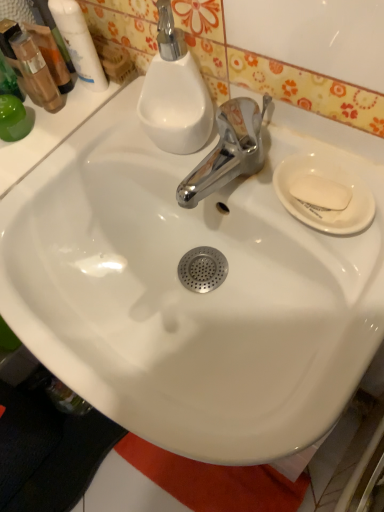
Image resolution: width=384 pixels, height=512 pixels. What do you see at coordinates (79, 42) in the screenshot?
I see `white glossy mouthwash at upper left, which is counted as the first mouthwash, starting from the right` at bounding box center [79, 42].

What is the approximate width of white glossy mouthwash at upper left, acting as the second mouthwash starting from the left?

1.27 inches.

This screenshot has width=384, height=512. What are the coordinates of `translucent plastic mouthwash at upper left, which is the second mouthwash in right-to-left order` in the screenshot? It's located at (32, 69).

Identify the location of white ceramic plate at right. (323, 195).

Is translucent plastic mouthwash at upper left, the 1th mouthwash in the left-to-right sequence, wider or thinner than white ceramic plate at right?

translucent plastic mouthwash at upper left, the 1th mouthwash in the left-to-right sequence, is thinner than white ceramic plate at right.

Is translucent plastic mouthwash at upper left, which is the second mouthwash in right-to-left order, to the left or to the right of white ceramic plate at right in the image?

Clearly, translucent plastic mouthwash at upper left, which is the second mouthwash in right-to-left order, is on the left of white ceramic plate at right in the image.

Is translucent plastic mouthwash at upper left, which is the second mouthwash in right-to-left order, taller or shorter than white ceramic plate at right?

Considering their sizes, translucent plastic mouthwash at upper left, which is the second mouthwash in right-to-left order, has more height than white ceramic plate at right.

From the picture: Is translucent plastic mouthwash at upper left, which is the second mouthwash in right-to-left order, surrounding white ceramic plate at right?

No, translucent plastic mouthwash at upper left, which is the second mouthwash in right-to-left order, does not contain white ceramic plate at right.

Can you confirm if white glossy mouthwash at upper left, acting as the second mouthwash starting from the left, is shorter than translucent plastic mouthwash at upper left, the 1th mouthwash in the left-to-right sequence?

No, white glossy mouthwash at upper left, acting as the second mouthwash starting from the left, is not shorter than translucent plastic mouthwash at upper left, the 1th mouthwash in the left-to-right sequence.

Is there a large distance between white glossy mouthwash at upper left, which is counted as the first mouthwash, starting from the right, and translucent plastic mouthwash at upper left, which is the second mouthwash in right-to-left order?

No, white glossy mouthwash at upper left, which is counted as the first mouthwash, starting from the right, is not far from translucent plastic mouthwash at upper left, which is the second mouthwash in right-to-left order.

Which is behind, white glossy mouthwash at upper left, acting as the second mouthwash starting from the left, or translucent plastic mouthwash at upper left, which is the second mouthwash in right-to-left order?

translucent plastic mouthwash at upper left, which is the second mouthwash in right-to-left order.

Consider the image. From the image's perspective, is white glossy mouthwash at upper left, acting as the second mouthwash starting from the left, on top of translucent plastic mouthwash at upper left, which is the second mouthwash in right-to-left order?

Yes, from the image's perspective, white glossy mouthwash at upper left, acting as the second mouthwash starting from the left, is over translucent plastic mouthwash at upper left, which is the second mouthwash in right-to-left order.

Can you confirm if white glossy mouthwash at upper left, acting as the second mouthwash starting from the left, is positioned to the left of white matte soap at right?

Indeed, white glossy mouthwash at upper left, acting as the second mouthwash starting from the left, is positioned on the left side of white matte soap at right.

Is point (72, 62) positioned behind point (329, 188)?

Yes.

The image size is (384, 512). Identify the location of soap lying below the white glossy mouthwash at upper left, acting as the second mouthwash starting from the left (from the image's perspective). (321, 192).

Can white glossy mouthwash at upper left, acting as the second mouthwash starting from the left, be found inside white matte soap at right?

No, white glossy mouthwash at upper left, acting as the second mouthwash starting from the left, is not surrounded by white matte soap at right.

This screenshot has height=512, width=384. I want to click on soap below the white glossy mouthwash at upper left, which is counted as the first mouthwash, starting from the right (from the image's perspective), so click(x=321, y=192).

Between white matte soap at right and white glossy mouthwash at upper left, acting as the second mouthwash starting from the left, which one has smaller width?

white glossy mouthwash at upper left, acting as the second mouthwash starting from the left, is thinner.

Which is more to the right, white matte soap at right or translucent plastic mouthwash at upper left, the 1th mouthwash in the left-to-right sequence?

white matte soap at right.

From the image's perspective, would you say white matte soap at right is shown under translucent plastic mouthwash at upper left, which is the second mouthwash in right-to-left order?

Yes.

Is white matte soap at right inside or outside of translucent plastic mouthwash at upper left, which is the second mouthwash in right-to-left order?

white matte soap at right is not inside translucent plastic mouthwash at upper left, which is the second mouthwash in right-to-left order, it's outside.

From a real-world perspective, is white ceramic plate at right physically located above or below white matte soap at right?

white ceramic plate at right is situated lower than white matte soap at right in the real world.

From the image's perspective, which object appears higher, white ceramic plate at right or white matte soap at right?

From the image's view, white matte soap at right is above.

Measure the distance between white ceramic plate at right and white matte soap at right.

0.49 inches.

What's the angular difference between white ceramic plate at right and white matte soap at right's facing directions?

The facing directions of white ceramic plate at right and white matte soap at right are 26.7 degrees apart.

How many degrees apart are the facing directions of white matte soap at right and white ceramic plate at right?

They differ by 26.7 degrees in their facing directions.

Which of these two, white matte soap at right or white ceramic plate at right, is thinner?

Thinner between the two is white matte soap at right.

Is white matte soap at right beside white ceramic plate at right?

Yes, white matte soap at right is touching white ceramic plate at right.

Who is taller, white matte soap at right or white ceramic plate at right?

white ceramic plate at right.

You are a GUI agent. You are given a task and a screenshot of the screen. Output one action in this format:
    pyautogui.click(x=<x>, y=<y>)
    Task: Click on the plate directly beneath the translucent plastic mouthwash at upper left, which is the second mouthwash in right-to-left order (from a real-world perspective)
    
    Given the screenshot: What is the action you would take?
    pyautogui.click(x=323, y=195)

This screenshot has height=512, width=384. Identify the location of mouthwash lying above the translucent plastic mouthwash at upper left, the 1th mouthwash in the left-to-right sequence (from the image's perspective). (79, 42).

Looking at the image, which one is located further to white matte soap at right, white glossy mouthwash at upper left, which is counted as the first mouthwash, starting from the right, or white ceramic plate at right?

Among the two, white glossy mouthwash at upper left, which is counted as the first mouthwash, starting from the right, is located further to white matte soap at right.

Looking at the image, which one is located closer to white ceramic plate at right, white glossy mouthwash at upper left, acting as the second mouthwash starting from the left, or translucent plastic mouthwash at upper left, which is the second mouthwash in right-to-left order?

white glossy mouthwash at upper left, acting as the second mouthwash starting from the left, is positioned closer to the anchor white ceramic plate at right.

Considering their positions, is white matte soap at right positioned closer to translucent plastic mouthwash at upper left, the 1th mouthwash in the left-to-right sequence, than white glossy mouthwash at upper left, acting as the second mouthwash starting from the left?

white glossy mouthwash at upper left, acting as the second mouthwash starting from the left, lies closer to translucent plastic mouthwash at upper left, the 1th mouthwash in the left-to-right sequence, than the other object.

Looking at the image, which one is located further to white ceramic plate at right, white matte soap at right or translucent plastic mouthwash at upper left, which is the second mouthwash in right-to-left order?

Among the two, translucent plastic mouthwash at upper left, which is the second mouthwash in right-to-left order, is located further to white ceramic plate at right.

When comparing their distances from translucent plastic mouthwash at upper left, which is the second mouthwash in right-to-left order, does white ceramic plate at right or white matte soap at right seem further?

white matte soap at right lies further to translucent plastic mouthwash at upper left, which is the second mouthwash in right-to-left order, than the other object.

From the picture: Based on their spatial positions, is white ceramic plate at right or white matte soap at right further from white glossy mouthwash at upper left, acting as the second mouthwash starting from the left?

Based on the image, white matte soap at right appears to be further to white glossy mouthwash at upper left, acting as the second mouthwash starting from the left.

Looking at the image, which one is located further to white ceramic plate at right, white matte soap at right or white glossy mouthwash at upper left, which is counted as the first mouthwash, starting from the right?

Based on the image, white glossy mouthwash at upper left, which is counted as the first mouthwash, starting from the right, appears to be further to white ceramic plate at right.

When comparing their distances from white glossy mouthwash at upper left, which is counted as the first mouthwash, starting from the right, does white matte soap at right or translucent plastic mouthwash at upper left, the 1th mouthwash in the left-to-right sequence, seem further?

white matte soap at right is further to white glossy mouthwash at upper left, which is counted as the first mouthwash, starting from the right.

Where is `plate located between white glossy mouthwash at upper left, which is counted as the first mouthwash, starting from the right, and white matte soap at right in the left-right direction`? plate located between white glossy mouthwash at upper left, which is counted as the first mouthwash, starting from the right, and white matte soap at right in the left-right direction is located at coordinates (323, 195).

Where is `mouthwash located between translucent plastic mouthwash at upper left, the 1th mouthwash in the left-to-right sequence, and white ceramic plate at right in the left-right direction`? The height and width of the screenshot is (512, 384). mouthwash located between translucent plastic mouthwash at upper left, the 1th mouthwash in the left-to-right sequence, and white ceramic plate at right in the left-right direction is located at coordinates (79, 42).

Locate an element on the screen. The width and height of the screenshot is (384, 512). plate located between translucent plastic mouthwash at upper left, which is the second mouthwash in right-to-left order, and white matte soap at right in the left-right direction is located at coordinates (323, 195).

Locate an element on the screen. mouthwash between translucent plastic mouthwash at upper left, which is the second mouthwash in right-to-left order, and white matte soap at right, in the horizontal direction is located at coordinates (79, 42).